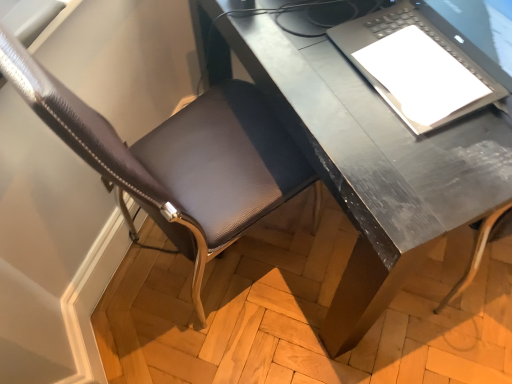
Identify the location of vacant space underneath matte black laptop at upper right (from a real-world perspective). (413, 59).